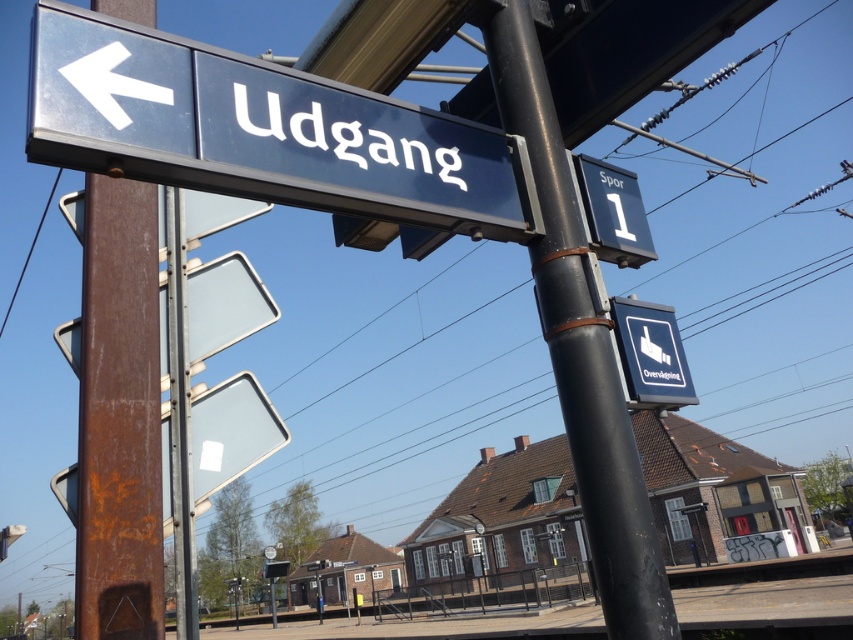
You are standing at the train station platform and need to locate the black metal pole at center. According to the coordinates provided, where exactly would you find it?

The black metal pole at center is located at point (x=579, y=342).

You are at the train station and need to find the exit. You see a blue plastic sign at lower right and a white plastic sign at upper center. Which sign is closer to you?

The blue plastic sign at lower right is closer to you since it is in front of the white plastic sign at upper center.